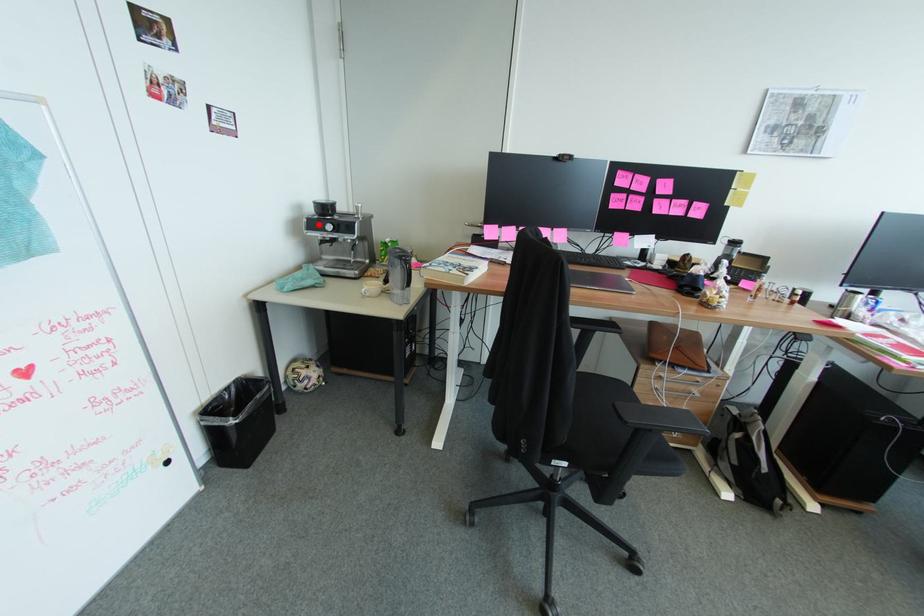
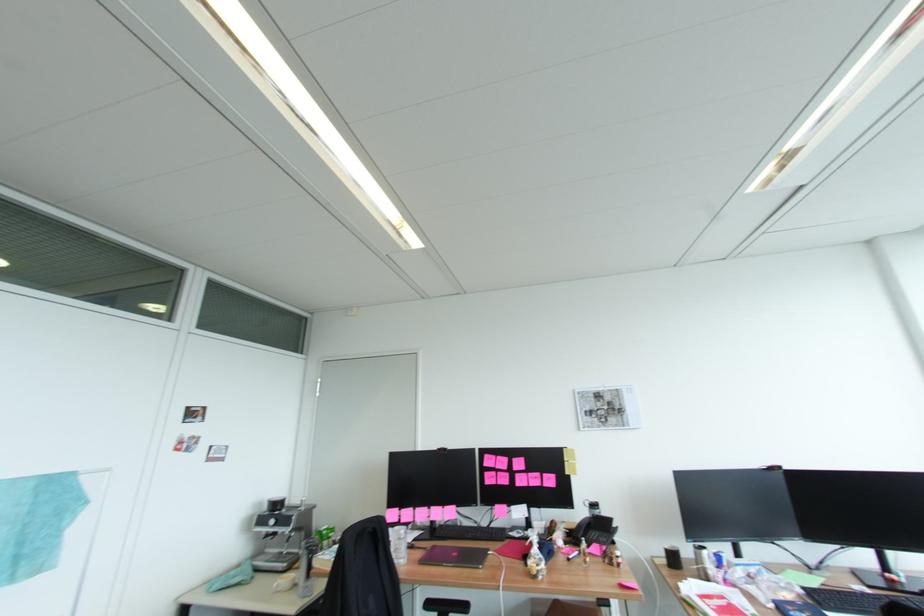
Find the pixel in the second image that matches the highlighted location in the first image.

(266, 520)